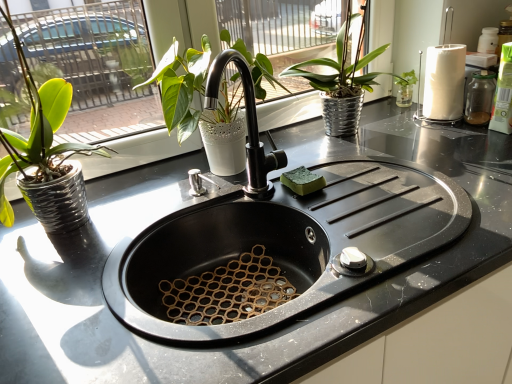
I want to click on matte white pot at upper center, marked as the 2th houseplant in a left-to-right arrangement, so click(x=193, y=91).

Find the location of a particular element. metallic silver pot at upper center, which is the first houseplant from right to left is located at coordinates (342, 81).

Is matte white pot at upper center, marked as the 2th houseplant in a left-to-right arrangement, oriented towards black matte sink at center?

Answer: No, matte white pot at upper center, marked as the 2th houseplant in a left-to-right arrangement, does not turn towards black matte sink at center.

From their relative heights in the image, would you say matte white pot at upper center, marked as the 2th houseplant in a left-to-right arrangement, is taller or shorter than black matte sink at center?

In the image, matte white pot at upper center, marked as the 2th houseplant in a left-to-right arrangement, appears to be shorter than black matte sink at center.

Between matte white pot at upper center, the 2th houseplant when ordered from right to left, and black matte sink at center, which one has larger size?

black matte sink at center is bigger.

Would you say matte white pot at upper center, marked as the 2th houseplant in a left-to-right arrangement, contains black matte sink at center?

Actually, black matte sink at center is outside matte white pot at upper center, marked as the 2th houseplant in a left-to-right arrangement.

Is metallic silver pot at upper center, positioned as the 3th houseplant in left-to-right order, oriented away from green matte plant at left, placed as the third houseplant when sorted from right to left?

metallic silver pot at upper center, positioned as the 3th houseplant in left-to-right order, is not turned away from green matte plant at left, placed as the third houseplant when sorted from right to left.

Which is correct: metallic silver pot at upper center, positioned as the 3th houseplant in left-to-right order, is inside green matte plant at left, placed as the 1th houseplant when sorted from left to right, or outside of it?

metallic silver pot at upper center, positioned as the 3th houseplant in left-to-right order, is spatially situated outside green matte plant at left, placed as the 1th houseplant when sorted from left to right.

How many degrees apart are the facing directions of metallic silver pot at upper center, positioned as the 3th houseplant in left-to-right order, and green matte plant at left, placed as the 1th houseplant when sorted from left to right?

There is a 0.643-degree angle between the facing directions of metallic silver pot at upper center, positioned as the 3th houseplant in left-to-right order, and green matte plant at left, placed as the 1th houseplant when sorted from left to right.

Which is in front, metallic silver pot at upper center, which is the first houseplant from right to left, or green matte plant at left, placed as the third houseplant when sorted from right to left?

green matte plant at left, placed as the third houseplant when sorted from right to left, is closer to the camera.

Is black matte sink at center oriented away from metallic silver pot at upper center, which is the first houseplant from right to left?

No, metallic silver pot at upper center, which is the first houseplant from right to left, is not at the back of black matte sink at center.

Does black matte sink at center have a lesser width compared to metallic silver pot at upper center, which is the first houseplant from right to left?

No.

Considering their positions, is black matte sink at center located in front of or behind metallic silver pot at upper center, positioned as the 3th houseplant in left-to-right order?

In the image, black matte sink at center appears in front of metallic silver pot at upper center, positioned as the 3th houseplant in left-to-right order.

Is black matte sink at center surrounding metallic silver pot at upper center, positioned as the 3th houseplant in left-to-right order?

No, black matte sink at center does not contain metallic silver pot at upper center, positioned as the 3th houseplant in left-to-right order.

Would you say black matte sink at center is to the left or to the right of matte white pot at upper center, the 2th houseplant when ordered from right to left, in the picture?

Based on their positions, black matte sink at center is located to the right of matte white pot at upper center, the 2th houseplant when ordered from right to left.

In terms of size, does black matte sink at center appear bigger or smaller than matte white pot at upper center, marked as the 2th houseplant in a left-to-right arrangement?

In the image, black matte sink at center appears to be larger than matte white pot at upper center, marked as the 2th houseplant in a left-to-right arrangement.

From a real-world perspective, who is located higher, black matte sink at center or matte white pot at upper center, marked as the 2th houseplant in a left-to-right arrangement?

From a 3D spatial view, matte white pot at upper center, marked as the 2th houseplant in a left-to-right arrangement, is above.

From the image's perspective, which is below, black matte sink at center or matte white pot at upper center, the 2th houseplant when ordered from right to left?

black matte sink at center, from the image's perspective.

From the image's perspective, is green matte plant at left, placed as the 1th houseplant when sorted from left to right, positioned above or below black matte sink at center?

Clearly, from the image's perspective, green matte plant at left, placed as the 1th houseplant when sorted from left to right, is above black matte sink at center.

Does point (0, 161) lie in front of point (450, 234)?

No, it is behind (450, 234).

Is the position of green matte plant at left, placed as the 1th houseplant when sorted from left to right, less distant than that of black matte sink at center?

No, it is not.

Considering the sizes of objects matte white pot at upper center, the 2th houseplant when ordered from right to left, and green matte plant at left, placed as the third houseplant when sorted from right to left, in the image provided, who is wider, matte white pot at upper center, the 2th houseplant when ordered from right to left, or green matte plant at left, placed as the third houseplant when sorted from right to left,?

With larger width is green matte plant at left, placed as the third houseplant when sorted from right to left.

Is matte white pot at upper center, marked as the 2th houseplant in a left-to-right arrangement, facing away from green matte plant at left, placed as the third houseplant when sorted from right to left?

matte white pot at upper center, marked as the 2th houseplant in a left-to-right arrangement, does not have its back to green matte plant at left, placed as the third houseplant when sorted from right to left.

Based on the photo, could green matte plant at left, placed as the 1th houseplant when sorted from left to right, be considered to be inside matte white pot at upper center, the 2th houseplant when ordered from right to left?

No, green matte plant at left, placed as the 1th houseplant when sorted from left to right, is located outside of matte white pot at upper center, the 2th houseplant when ordered from right to left.

From a real-world perspective, between green matte plant at left, placed as the 1th houseplant when sorted from left to right, and matte white pot at upper center, marked as the 2th houseplant in a left-to-right arrangement, who is vertically higher?

green matte plant at left, placed as the 1th houseplant when sorted from left to right, from a real-world perspective.

Which is in front, point (64, 84) or point (263, 95)?

Positioned in front is point (64, 84).

Find the location of a particular element. This screenshot has height=384, width=512. houseplant below the matte white pot at upper center, marked as the 2th houseplant in a left-to-right arrangement (from the image's perspective) is located at coordinates (40, 136).

Consider the image. Does green matte plant at left, placed as the third houseplant when sorted from right to left, have a lesser width compared to matte white pot at upper center, marked as the 2th houseplant in a left-to-right arrangement?

Incorrect, the width of green matte plant at left, placed as the third houseplant when sorted from right to left, is not less than that of matte white pot at upper center, marked as the 2th houseplant in a left-to-right arrangement.

Where is `sink that appears in front of the matte white pot at upper center, the 2th houseplant when ordered from right to left`? This screenshot has width=512, height=384. sink that appears in front of the matte white pot at upper center, the 2th houseplant when ordered from right to left is located at coordinates (283, 235).

This screenshot has height=384, width=512. Identify the location of the 2nd houseplant to the right of the green matte plant at left, placed as the third houseplant when sorted from right to left, starting your count from the anchor. (342, 81).

Considering their positions, is matte white pot at upper center, the 2th houseplant when ordered from right to left, positioned closer to green matte plant at left, placed as the 1th houseplant when sorted from left to right, than metallic silver pot at upper center, which is the first houseplant from right to left?

The object closer to green matte plant at left, placed as the 1th houseplant when sorted from left to right, is matte white pot at upper center, the 2th houseplant when ordered from right to left.

Estimate the real-world distances between objects in this image. Which object is closer to green matte plant at left, placed as the 1th houseplant when sorted from left to right, matte white pot at upper center, marked as the 2th houseplant in a left-to-right arrangement, or black matte sink at center?

Among the two, matte white pot at upper center, marked as the 2th houseplant in a left-to-right arrangement, is located nearer to green matte plant at left, placed as the 1th houseplant when sorted from left to right.

Looking at the image, which one is located further to metallic silver pot at upper center, which is the first houseplant from right to left, matte white pot at upper center, marked as the 2th houseplant in a left-to-right arrangement, or green matte plant at left, placed as the 1th houseplant when sorted from left to right?

The object further to metallic silver pot at upper center, which is the first houseplant from right to left, is green matte plant at left, placed as the 1th houseplant when sorted from left to right.

Looking at the image, which one is located further to matte white pot at upper center, marked as the 2th houseplant in a left-to-right arrangement, black matte sink at center or green matte plant at left, placed as the third houseplant when sorted from right to left?

The object further to matte white pot at upper center, marked as the 2th houseplant in a left-to-right arrangement, is green matte plant at left, placed as the third houseplant when sorted from right to left.

Which object lies further to the anchor point green matte plant at left, placed as the third houseplant when sorted from right to left, black matte sink at center or matte white pot at upper center, marked as the 2th houseplant in a left-to-right arrangement?

Among the two, black matte sink at center is located further to green matte plant at left, placed as the third houseplant when sorted from right to left.

Based on their spatial positions, is green matte plant at left, placed as the third houseplant when sorted from right to left, or metallic silver pot at upper center, positioned as the 3th houseplant in left-to-right order, further from black matte sink at center?

Based on the image, green matte plant at left, placed as the third houseplant when sorted from right to left, appears to be further to black matte sink at center.

Which object lies further to the anchor point matte white pot at upper center, marked as the 2th houseplant in a left-to-right arrangement, green matte plant at left, placed as the 1th houseplant when sorted from left to right, or black matte sink at center?

The object further to matte white pot at upper center, marked as the 2th houseplant in a left-to-right arrangement, is green matte plant at left, placed as the 1th houseplant when sorted from left to right.

Considering their positions, is metallic silver pot at upper center, positioned as the 3th houseplant in left-to-right order, positioned further to matte white pot at upper center, marked as the 2th houseplant in a left-to-right arrangement, than black matte sink at center?

metallic silver pot at upper center, positioned as the 3th houseplant in left-to-right order.

You are a GUI agent. You are given a task and a screenshot of the screen. Output one action in this format:
    pyautogui.click(x=<x>, y=<y>)
    Task: Click on the houseplant between green matte plant at left, placed as the 1th houseplant when sorted from left to right, and metallic silver pot at upper center, which is the first houseplant from right to left, in the horizontal direction
    
    Given the screenshot: What is the action you would take?
    pyautogui.click(x=193, y=91)